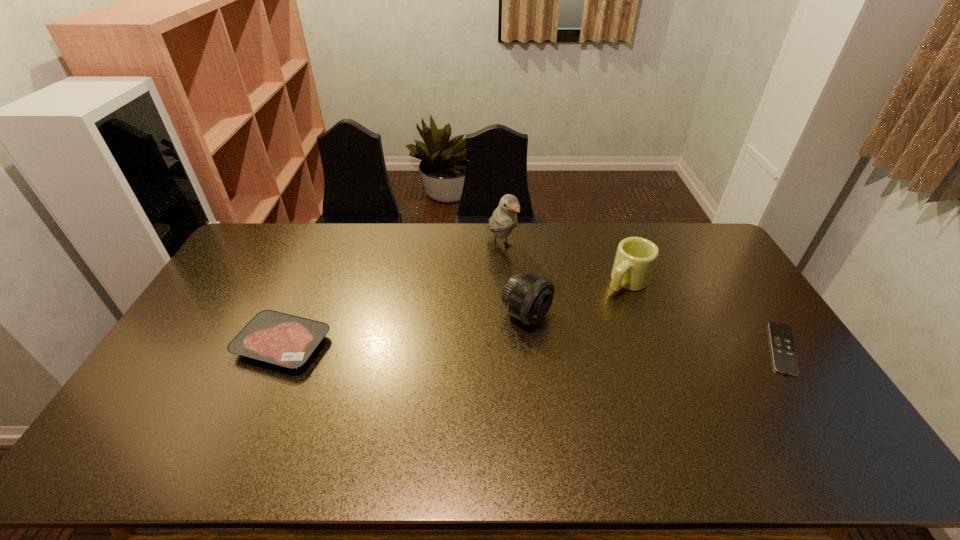
At what (x,y) coordinates should I click in order to perform the action: click on vacant position in the image that satisfies the following two spatial constraints: 1. on the front side of the shortest object; 2. on the left side of the fourth object from left to right. Please return your answer as a coordinate pair (x, y). This screenshot has height=540, width=960. Looking at the image, I should click on (653, 348).

You are a GUI agent. You are given a task and a screenshot of the screen. Output one action in this format:
    pyautogui.click(x=<x>, y=<y>)
    Task: Click on the vacant region that satisfies the following two spatial constraints: 1. on the front side of the remote control; 2. on the left side of the leftmost object
    The height and width of the screenshot is (540, 960).
    Given the screenshot: What is the action you would take?
    pyautogui.click(x=281, y=348)

Locate an element on the screen. This screenshot has width=960, height=540. vacant region that satisfies the following two spatial constraints: 1. on the front side of the remote control; 2. on the right side of the mug is located at coordinates (653, 348).